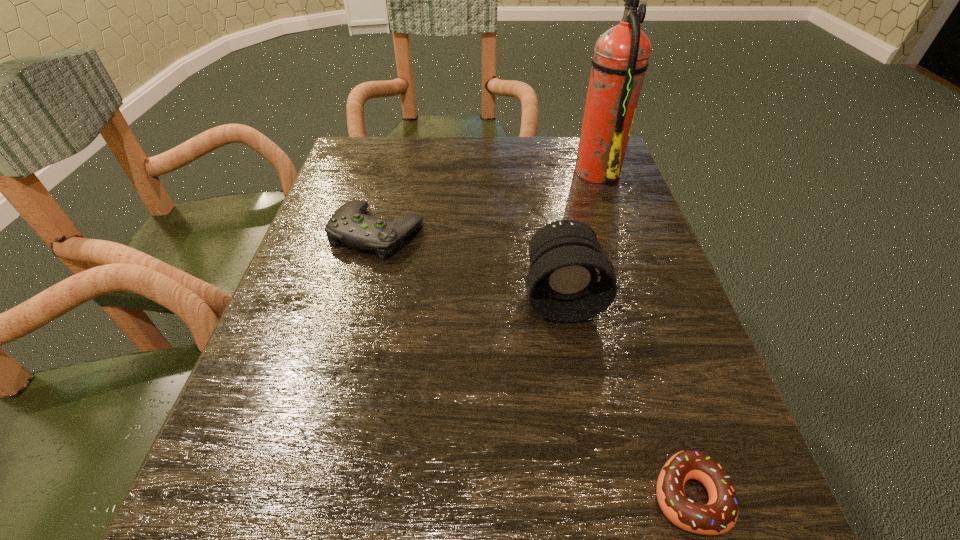
You are a GUI agent. You are given a task and a screenshot of the screen. Output one action in this format:
    pyautogui.click(x=<x>, y=<y>)
    Task: Click on the free space located 0.230m at the front element of the second nearest object
    The image size is (960, 540).
    Given the screenshot: What is the action you would take?
    click(591, 460)

Identify the location of vacant space located 0.310m on the right of the control. This screenshot has height=540, width=960. (572, 232).

I want to click on free space located 0.180m on the left of the nearest object, so click(x=508, y=496).

Where is `object located in the far edge section of the desktop`? object located in the far edge section of the desktop is located at coordinates (621, 55).

What are the coordinates of `object situated at the near edge` in the screenshot? It's located at (719, 515).

Image resolution: width=960 pixels, height=540 pixels. I want to click on object present at the left edge, so click(x=349, y=225).

Find the location of a particular element. This screenshot has width=960, height=540. fire extinguisher that is at the right edge is located at coordinates (621, 55).

You are a GUI agent. You are given a task and a screenshot of the screen. Output one action in this format:
    pyautogui.click(x=<x>, y=<y>)
    Task: Click on the telephoto lens situated at the right edge
    The height and width of the screenshot is (540, 960).
    Given the screenshot: What is the action you would take?
    pyautogui.click(x=569, y=280)

Where is `doughnut that is at the right edge`? doughnut that is at the right edge is located at coordinates (719, 515).

Identify the location of object present at the far right corner. The image size is (960, 540). (621, 55).